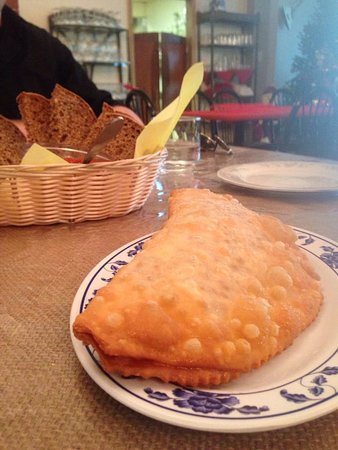
This screenshot has height=450, width=338. I want to click on plate, so click(154, 393), click(259, 187).